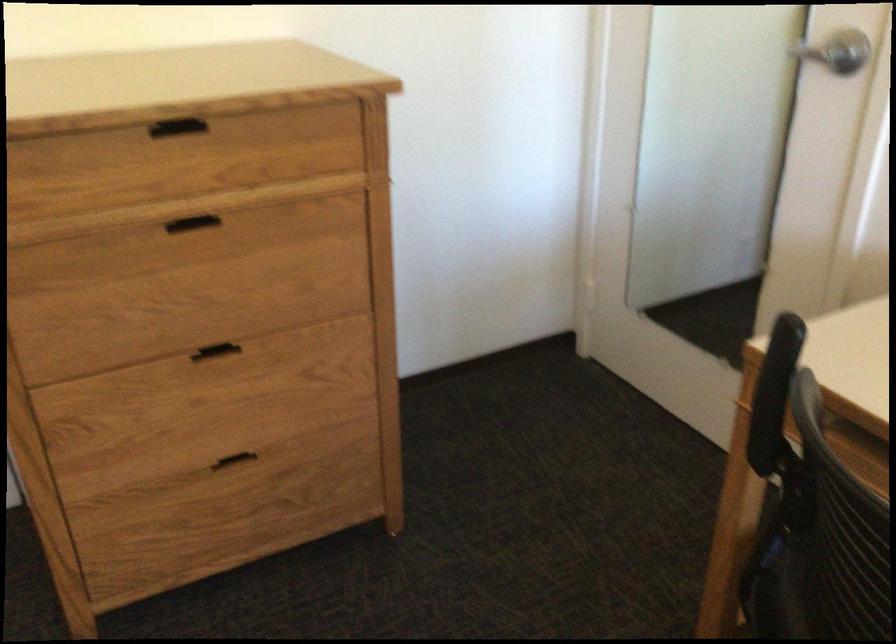
First-person continuous shooting, in which direction is the camera rotating?

The camera rotated toward left-down.